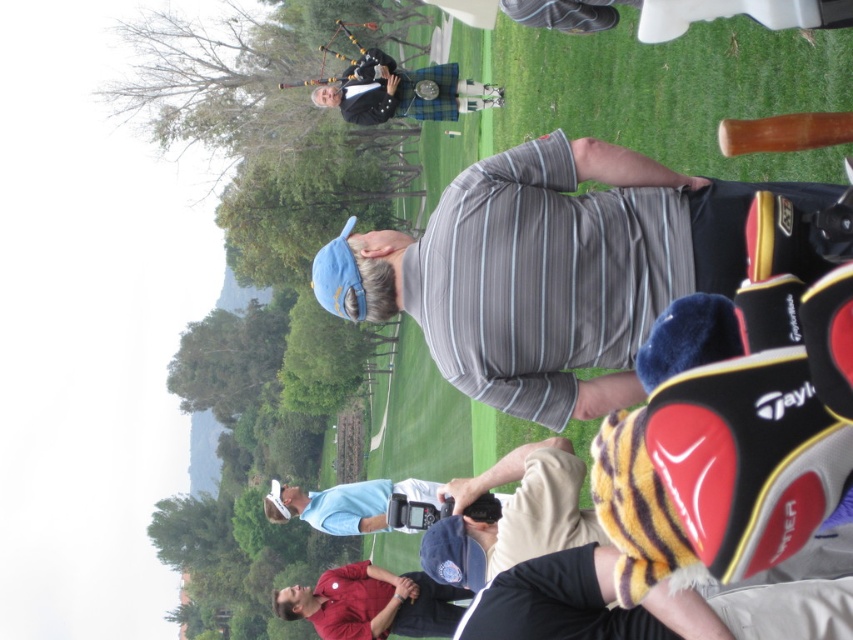
You are a photographer positioned at the center of the scene. You notice the matte red shirt at lower center and the plaid fabric kilt at upper center. Which of these two items is positioned to the right of the other?

The matte red shirt at lower center is to the right of the plaid fabric kilt at upper center.

You are a photographer trying to capture a photo of the gray striped shirt at center and the plaid fabric kilt at upper center. Which of the two items should you focus on first if you want to ensure both are in focus, given their relative heights?

The gray striped shirt at center has a greater height compared to the plaid fabric kilt at upper center. Therefore, you should focus on the gray striped shirt at center first to ensure both are in focus since it is taller and might require more precise focusing.